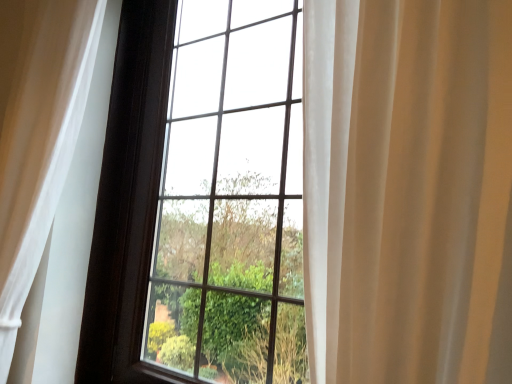
The height and width of the screenshot is (384, 512). In order to click on white sheer curtain at left in this screenshot , I will do `click(37, 133)`.

This screenshot has height=384, width=512. What do you see at coordinates (37, 133) in the screenshot?
I see `white sheer curtain at left` at bounding box center [37, 133].

In order to click on transparent glass window at center in this screenshot , I will do `click(231, 197)`.

This screenshot has width=512, height=384. What do you see at coordinates (231, 197) in the screenshot? I see `transparent glass window at center` at bounding box center [231, 197].

You are a GUI agent. You are given a task and a screenshot of the screen. Output one action in this format:
    pyautogui.click(x=<x>, y=<y>)
    Task: Click on the white sheer curtain at left
    The width and height of the screenshot is (512, 384).
    Given the screenshot: What is the action you would take?
    pyautogui.click(x=37, y=133)

Which object is positioned more to the right, white sheer curtain at left or transparent glass window at center?

From the viewer's perspective, transparent glass window at center appears more on the right side.

Considering their positions, is white sheer curtain at left located in front of or behind transparent glass window at center?

In the image, white sheer curtain at left appears behind transparent glass window at center.

Does point (6, 222) come closer to viewer compared to point (211, 288)?

That is True.

From the image's perspective, which object appears higher, white sheer curtain at left or transparent glass window at center?

white sheer curtain at left, from the image's perspective.

From a real-world perspective, is white sheer curtain at left physically below transparent glass window at center?

Yes.

Looking at their sizes, would you say white sheer curtain at left is wider or thinner than transparent glass window at center?

Clearly, white sheer curtain at left has more width compared to transparent glass window at center.

Who is taller, white sheer curtain at left or transparent glass window at center?

Standing taller between the two is transparent glass window at center.

Considering the sizes of objects white sheer curtain at left and transparent glass window at center in the image provided, who is bigger, white sheer curtain at left or transparent glass window at center?

With larger size is transparent glass window at center.

Is white sheer curtain at left positioned beyond the bounds of transparent glass window at center?

Yes, white sheer curtain at left is not within transparent glass window at center.

Is white sheer curtain at left far from transparent glass window at center?

No, white sheer curtain at left is not far away from transparent glass window at center.

Is white sheer curtain at left positioned with its back to transparent glass window at center?

No, white sheer curtain at left's orientation is not away from transparent glass window at center.

How different are the orientations of white sheer curtain at left and transparent glass window at center in degrees?

The angular difference between white sheer curtain at left and transparent glass window at center is 0.00389 degrees.

Where is `bay window that is on the right side of white sheer curtain at left`? This screenshot has height=384, width=512. bay window that is on the right side of white sheer curtain at left is located at coordinates (231, 197).

Which object is positioned more to the left, transparent glass window at center or white sheer curtain at left?

From the viewer's perspective, white sheer curtain at left appears more on the left side.

Considering the relative positions of transparent glass window at center and white sheer curtain at left in the image provided, is transparent glass window at center behind white sheer curtain at left?

No, it is in front of white sheer curtain at left.

In the scene shown: Which is closer, (191, 358) or (65, 171)?

Point (191, 358).

From the image's perspective, between transparent glass window at center and white sheer curtain at left, which one is located above?

white sheer curtain at left is shown above in the image.

From a real-world perspective, between transparent glass window at center and white sheer curtain at left, who is vertically higher?

transparent glass window at center is physically above.

Which object is wider, transparent glass window at center or white sheer curtain at left?

white sheer curtain at left.

Based on the photo, between transparent glass window at center and white sheer curtain at left, which one has less height?

white sheer curtain at left.

Based on the photo, considering the sizes of transparent glass window at center and white sheer curtain at left in the image, is transparent glass window at center bigger or smaller than white sheer curtain at left?

Clearly, transparent glass window at center is larger in size than white sheer curtain at left.

Is white sheer curtain at left completely or partially inside transparent glass window at center?

No, white sheer curtain at left is located outside of transparent glass window at center.

Is transparent glass window at center next to white sheer curtain at left?

There is a gap between transparent glass window at center and white sheer curtain at left.

Is transparent glass window at center aimed at white sheer curtain at left?

Yes, transparent glass window at center is aimed at white sheer curtain at left.

Looking at this image, how many degrees apart are the facing directions of transparent glass window at center and white sheer curtain at left?

transparent glass window at center and white sheer curtain at left are facing 0.00389 degrees away from each other.

You are a GUI agent. You are given a task and a screenshot of the screen. Output one action in this format:
    pyautogui.click(x=<x>, y=<y>)
    Task: Click on the bay window on the right of white sheer curtain at left
    Image resolution: width=512 pixels, height=384 pixels.
    Given the screenshot: What is the action you would take?
    pyautogui.click(x=231, y=197)

At what (x,y) coordinates should I click in order to perform the action: click on curtain that appears behind the transparent glass window at center. Please return your answer as a coordinate pair (x, y). Image resolution: width=512 pixels, height=384 pixels. Looking at the image, I should click on (37, 133).

Where is `curtain that appears on the left of transparent glass window at center`? The image size is (512, 384). curtain that appears on the left of transparent glass window at center is located at coordinates (37, 133).